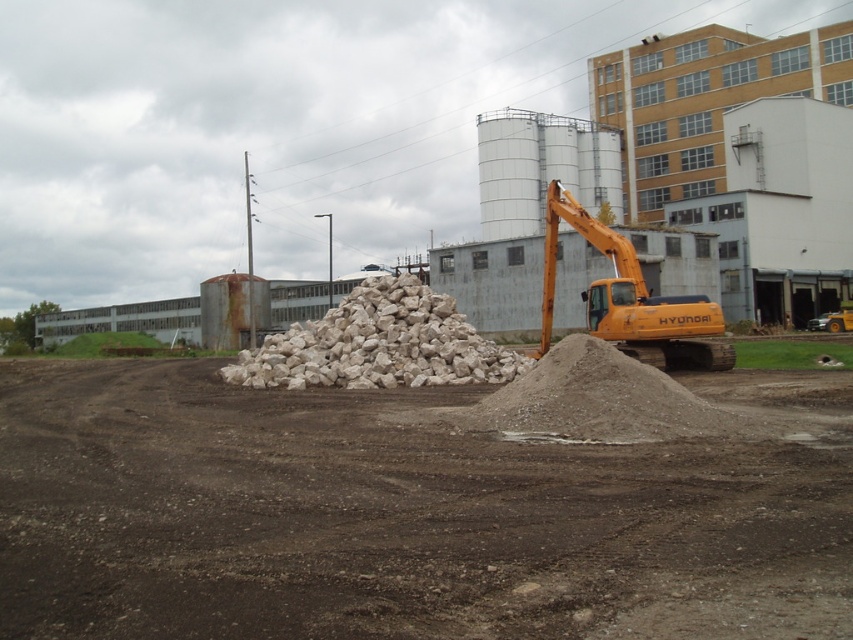
Question: Does white rough stone at center appear under orange metallic excavator at center-right?

Choices:
 (A) no
 (B) yes

Answer: (B)

Question: Which point is farther from the camera taking this photo?

Choices:
 (A) (425, 355)
 (B) (630, 244)
 (C) (647, 547)

Answer: (B)

Question: Is white rough stone at center to the right of orange metallic excavator at center-right from the viewer's perspective?

Choices:
 (A) no
 (B) yes

Answer: (A)

Question: Which object appears farthest from the camera in this image?

Choices:
 (A) white rough stone at center
 (B) brown/dry soil at center

Answer: (A)

Question: Can you confirm if brown/dry soil at center is positioned to the left of white rough stone at center?

Choices:
 (A) no
 (B) yes

Answer: (A)

Question: Considering the real-world distances, which object is farthest from the white rough stone at center?

Choices:
 (A) orange metallic excavator at center-right
 (B) brown/dry soil at center

Answer: (A)